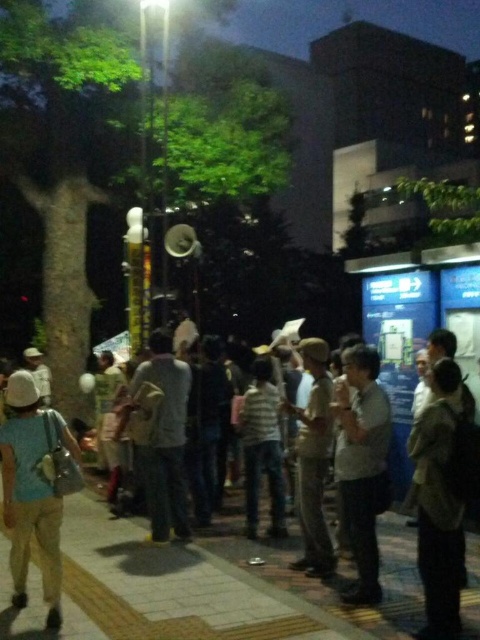
Who is higher up, dark brown leather jacket at lower right or khaki fabric pants at center?

Positioned higher is khaki fabric pants at center.

Who is lower down, dark brown leather jacket at lower right or khaki fabric pants at center?

dark brown leather jacket at lower right is lower down.

Image resolution: width=480 pixels, height=640 pixels. Identify the location of dark brown leather jacket at lower right. (441, 497).

Is dark clothing crowd at center further to the viewer compared to khaki fabric pants at center?

No, dark clothing crowd at center is in front of khaki fabric pants at center.

Is point (116, 614) positioned before point (313, 394)?

Yes, it is.

Where is `dark clothing crowd at center`? dark clothing crowd at center is located at coordinates (212, 586).

Is dark brown leather jacket at lower right positioned in front of light brown fabric jacket at center?

Yes.

Who is more distant from viewer, (454, 413) or (160, 531)?

The point (160, 531) is behind.

This screenshot has width=480, height=640. I want to click on dark brown leather jacket at lower right, so click(441, 497).